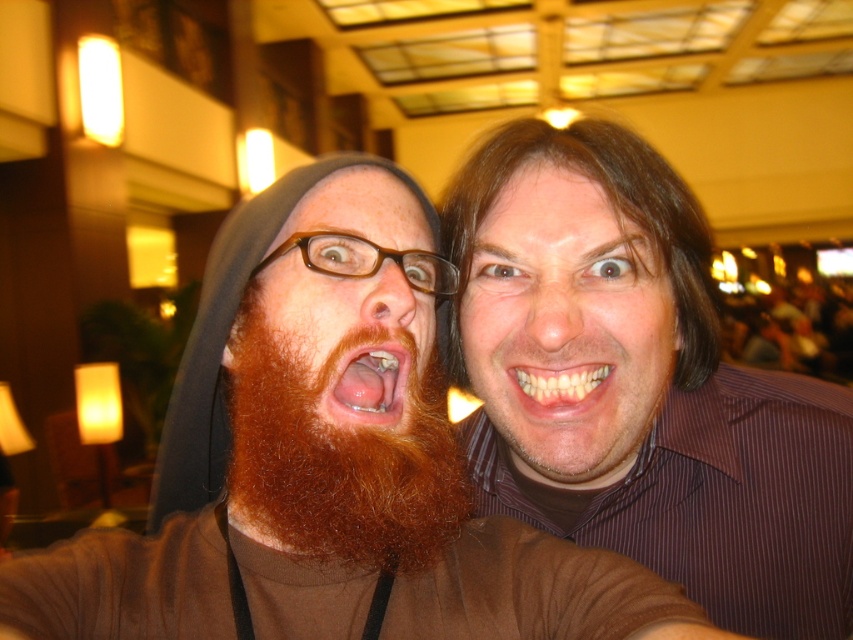
You are taking a photo of two people in the scene described. You notice the brown matte beard at center and the pink flesh at center. Which one is positioned to the left of the other?

The brown matte beard at center is to the left of pink flesh at center.